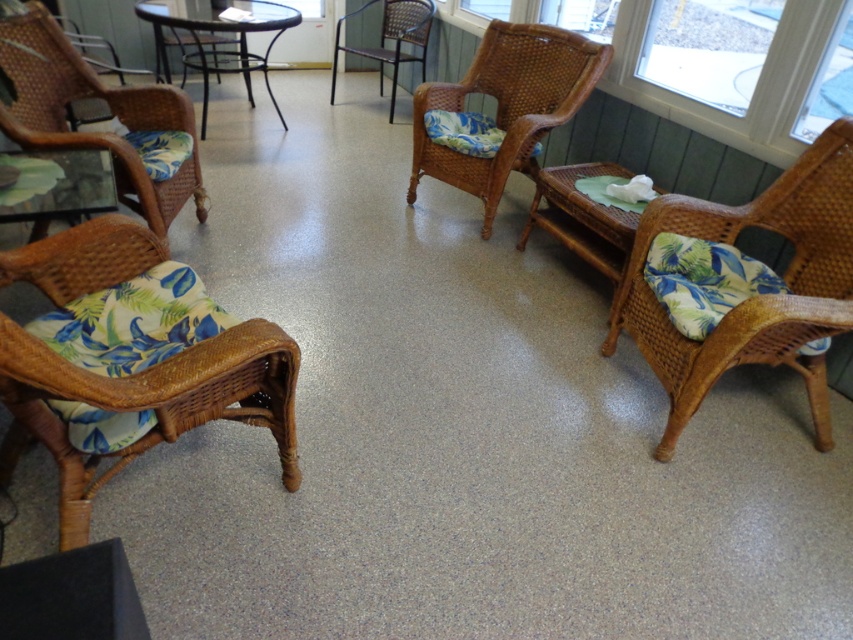
Question: Which object appears closest to the camera in this image?

Choices:
 (A) woven wicker armchair at right
 (B) metallic silver chair at center

Answer: (A)

Question: Is woven rattan chair with floral cushion at left above clear glass table at lower left?

Choices:
 (A) yes
 (B) no

Answer: (A)

Question: Is woven wicker armchair at right bigger than black glass table at upper left?

Choices:
 (A) no
 (B) yes

Answer: (A)

Question: Which point is farther from the camera taking this photo?

Choices:
 (A) tap(67, 189)
 (B) tap(810, 170)

Answer: (A)

Question: Which object is closer to the camera taking this photo?

Choices:
 (A) woven rattan chair with floral cushion at left
 (B) woven rattan rocking chair at lower left
 (C) black glass table at upper left
 (D) metallic silver chair at center

Answer: (B)

Question: Is the position of black glass table at upper left more distant than that of metallic silver chair at center?

Choices:
 (A) no
 (B) yes

Answer: (A)